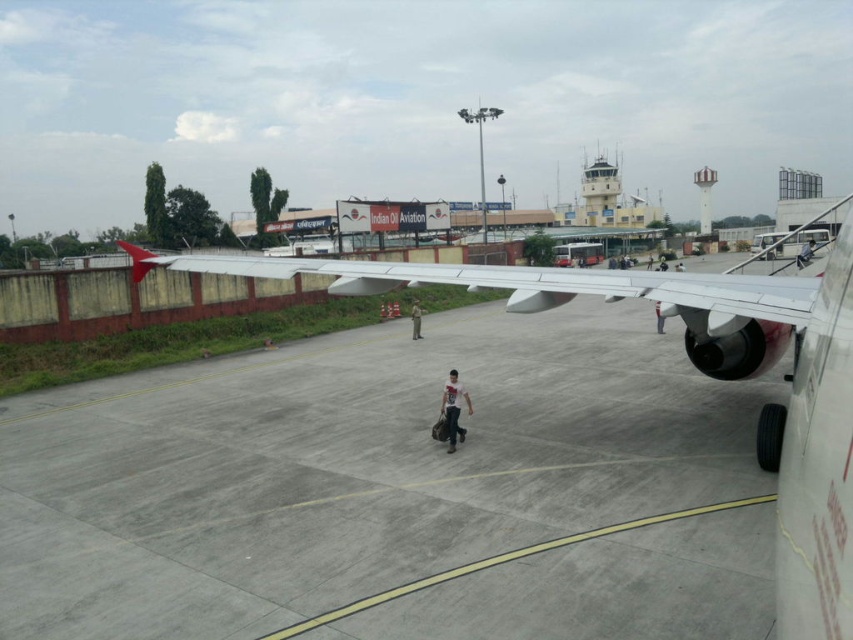
You are a passenger sitting in the aircraft cabin. You look out the window and see the polished aluminum wing at center and the gray fabric pants at center. Which object is closer to you?

The polished aluminum wing at center is closer to you because it is taller than the gray fabric pants at center, indicating it is nearer in the field of view.

You are a passenger on an airplane and you see the metallic gray wing at center and the matte black person at center from your seat. Which object takes up more space in your view?

The metallic gray wing at center takes up more space in your view because it has a larger size compared to the matte black person at center.